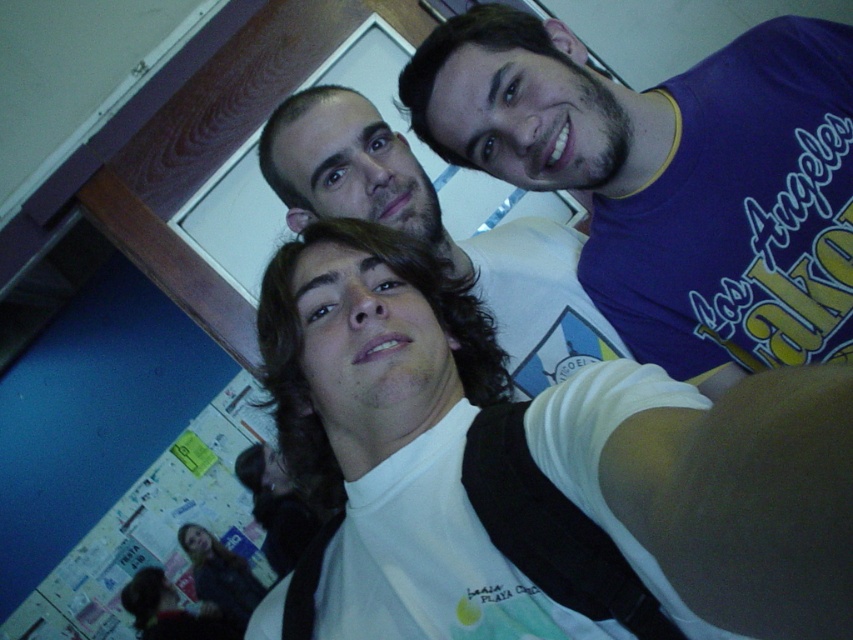
Is white matte shirt at center wider than smooth black hair at lower left?

Answer: Correct, the width of white matte shirt at center exceeds that of smooth black hair at lower left.

Is point (552, 292) less distant than point (241, 577)?

Yes, point (552, 292) is in front of point (241, 577).

Is point (277, 195) positioned after point (215, 552)?

No, (277, 195) is in front of (215, 552).

This screenshot has width=853, height=640. What are the coordinates of `white matte shirt at center` in the screenshot? It's located at (436, 228).

Which is in front, point (387, 536) or point (245, 563)?

Point (387, 536)

Does white matte t-shirt at center come in front of smooth black hair at lower left?

Yes, it is.

Identify the location of white matte t-shirt at center. (535, 474).

Is white matte t-shirt at center above white matte shirt at center?

Incorrect, white matte t-shirt at center is not positioned above white matte shirt at center.

Between point (750, 461) and point (265, 172), which one is positioned behind?

The point (265, 172) is behind.

I want to click on white matte t-shirt at center, so click(535, 474).